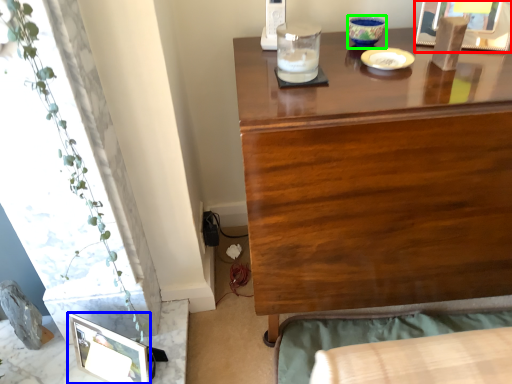
Question: Which object is the closest to the picture frame (highlighted by a red box)? Choose among these: picture frame (highlighted by a blue box) or candle holder (highlighted by a green box).

Choices:
 (A) picture frame
 (B) candle holder

Answer: (B)